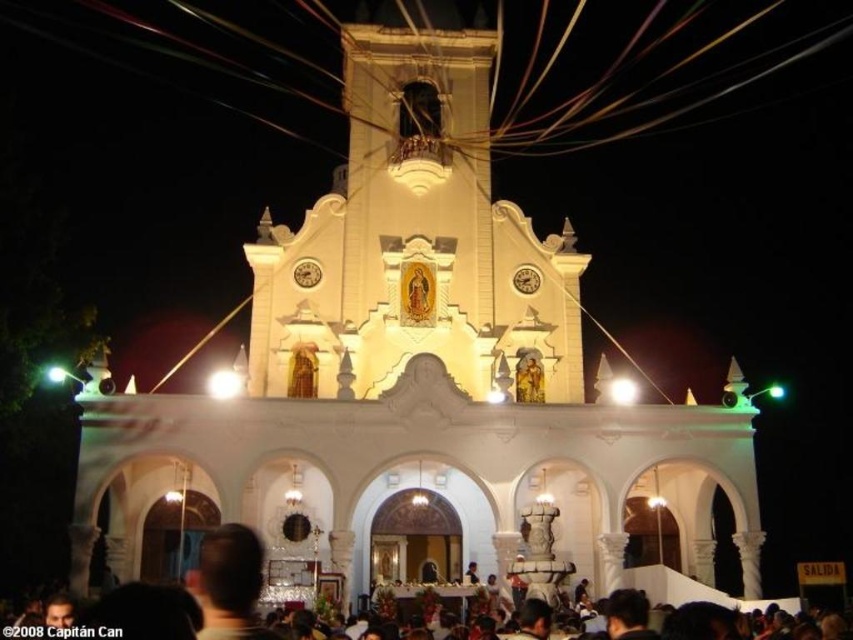
Which of these two, metallic wire at upper center or black matte crowd at lower center, stands taller?

metallic wire at upper center is taller.

You are a GUI agent. You are given a task and a screenshot of the screen. Output one action in this format:
    pyautogui.click(x=<x>, y=<y>)
    Task: Click on the metallic wire at upper center
    
    Given the screenshot: What is the action you would take?
    pyautogui.click(x=646, y=65)

Locate an element on the screen. The height and width of the screenshot is (640, 853). metallic wire at upper center is located at coordinates (646, 65).